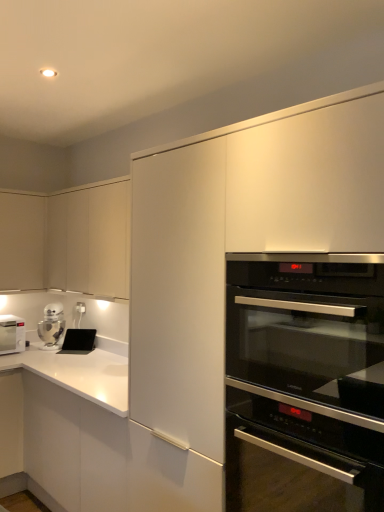
Question: Is matte white cabinet at upper left, arranged as the second cabinetry when viewed from the right, next to black glass oven at center right?

Choices:
 (A) yes
 (B) no

Answer: (B)

Question: From the image's perspective, is matte white cabinet at upper left, positioned as the 1th cabinetry in left-to-right order, under black glass oven at center right?

Choices:
 (A) no
 (B) yes

Answer: (A)

Question: From the image's perspective, is matte white cabinet at upper left, positioned as the 1th cabinetry in left-to-right order, located above black glass oven at center right?

Choices:
 (A) yes
 (B) no

Answer: (A)

Question: Can you confirm if matte white cabinet at upper left, positioned as the 1th cabinetry in left-to-right order, is taller than black glass oven at center right?

Choices:
 (A) no
 (B) yes

Answer: (B)

Question: Is matte white cabinet at upper left, arranged as the second cabinetry when viewed from the right, outside black glass oven at center right?

Choices:
 (A) no
 (B) yes

Answer: (B)

Question: From the image's perspective, relative to silver metallic robot at lower left, is matte white cabinet at upper left, the second cabinetry in the left-to-right sequence, above or below?

Choices:
 (A) below
 (B) above

Answer: (B)

Question: Is matte white cabinet at upper left, the second cabinetry in the left-to-right sequence, taller or shorter than silver metallic robot at lower left?

Choices:
 (A) short
 (B) tall

Answer: (B)

Question: Considering the positions of matte white cabinet at upper left, the second cabinetry in the left-to-right sequence, and silver metallic robot at lower left in the image, is matte white cabinet at upper left, the second cabinetry in the left-to-right sequence, wider or thinner than silver metallic robot at lower left?

Choices:
 (A) thin
 (B) wide

Answer: (B)

Question: Is matte white cabinet at upper left, the second cabinetry in the left-to-right sequence, in front of or behind silver metallic robot at lower left in the image?

Choices:
 (A) front
 (B) behind

Answer: (A)

Question: From their relative heights in the image, would you say matte white cabinet at upper left, arranged as the 1th cabinetry when viewed from the right, is taller or shorter than black matte tablet at lower left?

Choices:
 (A) short
 (B) tall

Answer: (B)

Question: Is matte white cabinet at upper left, arranged as the 1th cabinetry when viewed from the right, situated inside black matte tablet at lower left or outside?

Choices:
 (A) outside
 (B) inside

Answer: (A)

Question: Is matte white cabinet at upper left, arranged as the 1th cabinetry when viewed from the right, in front of or behind black matte tablet at lower left in the image?

Choices:
 (A) front
 (B) behind

Answer: (A)

Question: From a real-world perspective, is matte white cabinet at upper left, arranged as the 1th cabinetry when viewed from the right, positioned above or below black matte tablet at lower left?

Choices:
 (A) above
 (B) below

Answer: (A)

Question: Considering the relative positions of white plastic electric outlet at upper left and matte white cabinet at upper left, arranged as the 1th cabinetry when viewed from the right, in the image provided, is white plastic electric outlet at upper left to the left or to the right of matte white cabinet at upper left, arranged as the 1th cabinetry when viewed from the right,?

Choices:
 (A) left
 (B) right

Answer: (A)

Question: From the image's perspective, is white plastic electric outlet at upper left located above or below matte white cabinet at upper left, arranged as the 1th cabinetry when viewed from the right?

Choices:
 (A) above
 (B) below

Answer: (B)